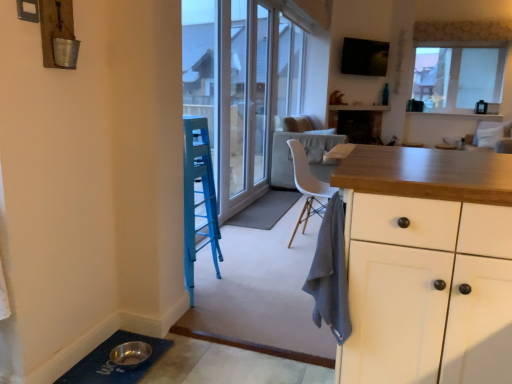
Identify the location of white plastic chair at center. Image resolution: width=512 pixels, height=384 pixels. (307, 186).

What is the approximate height of white fabric armchair at upper right?

It is 23.00 inches.

This screenshot has height=384, width=512. Describe the element at coordinates (331, 273) in the screenshot. I see `gray cotton towel at center` at that location.

Find the location of a particular element. The image size is (512, 384). gray fabric doormat at center, the 1th doormat from the right is located at coordinates (265, 210).

The image size is (512, 384). Identify the location of transparent glass window at upper right. (458, 77).

Find the location of `white plastic chair at center`. white plastic chair at center is located at coordinates pyautogui.click(x=307, y=186).

Who is smaller, white glossy screen door at center or transparent glass window at upper right?

white glossy screen door at center.

Between white glossy screen door at center and transparent glass window at upper right, which one is positioned behind?

transparent glass window at upper right.

From a real-world perspective, is white glossy screen door at center positioned above or below transparent glass window at upper right?

white glossy screen door at center is situated lower than transparent glass window at upper right in the real world.

Is gray fabric doormat at center, arranged as the second doormat when ordered from the bottom, far away from gray cotton towel at center?

Yes.

How far apart are gray fabric doormat at center, placed as the 1th doormat when sorted from back to front, and gray cotton towel at center?

gray fabric doormat at center, placed as the 1th doormat when sorted from back to front, is 7.95 feet from gray cotton towel at center.

Looking at this image, is gray fabric doormat at center, the 1th doormat from the right, wider or thinner than gray cotton towel at center?

Clearly, gray fabric doormat at center, the 1th doormat from the right, has more width compared to gray cotton towel at center.

You are a GUI agent. You are given a task and a screenshot of the screen. Output one action in this format:
    pyautogui.click(x=<x>, y=<y>)
    Task: Click on the doormat above the gray cotton towel at center (from the image's perspective)
    Image resolution: width=512 pixels, height=384 pixels.
    Given the screenshot: What is the action you would take?
    [x=265, y=210]

From a real-world perspective, which is physically below, transparent glass window at upper right or white glossy screen door at center?

white glossy screen door at center is physically lower.

Considering the positions of point (490, 89) and point (224, 53), is point (490, 89) closer or farther from the camera than point (224, 53)?

Clearly, point (490, 89) is more distant from the camera than point (224, 53).

Based on the photo, is transparent glass window at upper right not within white glossy screen door at center?

That's correct, transparent glass window at upper right is outside of white glossy screen door at center.

Between transparent glass window at upper right and white glossy screen door at center, which one has less height?

Standing shorter between the two is transparent glass window at upper right.

How far apart are gray fabric doormat at center, arranged as the second doormat when ordered from the bottom, and white plastic chair at center?

gray fabric doormat at center, arranged as the second doormat when ordered from the bottom, is 17.12 inches from white plastic chair at center.

Is gray fabric doormat at center, marked as the 1th doormat in a top-to-bottom arrangement, located outside white plastic chair at center?

Absolutely, gray fabric doormat at center, marked as the 1th doormat in a top-to-bottom arrangement, is external to white plastic chair at center.

Which is in front, point (233, 216) or point (324, 191)?

Positioned in front is point (324, 191).

Is blue rubber doormat at lower left, which is counted as the first doormat, starting from the left, completely or partially inside gray fabric doormat at center, arranged as the 2th doormat when viewed from the left?

No, gray fabric doormat at center, arranged as the 2th doormat when viewed from the left, does not contain blue rubber doormat at lower left, which is counted as the first doormat, starting from the left.

Locate an element on the screen. doormat below the gray fabric doormat at center, the 1th doormat from the right (from the image's perspective) is located at coordinates (114, 363).

Which of these two, gray fabric doormat at center, which is the 2th doormat from front to back, or blue rubber doormat at lower left, which is counted as the first doormat, starting from the left, is thinner?

gray fabric doormat at center, which is the 2th doormat from front to back, is thinner.

Considering the relative sizes of white glossy screen door at center and blue rubber doormat at lower left, which is the 2th doormat from back to front, in the image provided, is white glossy screen door at center bigger than blue rubber doormat at lower left, which is the 2th doormat from back to front,?

Correct, white glossy screen door at center is larger in size than blue rubber doormat at lower left, which is the 2th doormat from back to front.

From a real-world perspective, is white glossy screen door at center positioned over blue rubber doormat at lower left, marked as the 2th doormat in a top-to-bottom arrangement, based on gravity?

Indeed, from a real-world perspective, white glossy screen door at center stands above blue rubber doormat at lower left, marked as the 2th doormat in a top-to-bottom arrangement.

Can you tell me how much white glossy screen door at center and blue rubber doormat at lower left, marked as the 2th doormat in a top-to-bottom arrangement, differ in facing direction?

89.1 degrees separate the facing orientations of white glossy screen door at center and blue rubber doormat at lower left, marked as the 2th doormat in a top-to-bottom arrangement.

Is blue rubber doormat at lower left, which is counted as the first doormat, starting from the left, completely or partially inside white glossy screen door at center?

No, blue rubber doormat at lower left, which is counted as the first doormat, starting from the left, is not inside white glossy screen door at center.

The height and width of the screenshot is (384, 512). I want to click on cloth below the white fabric armchair at upper right (from the image's perspective), so click(331, 273).

From a real-world perspective, is white fabric armchair at upper right positioned above or below gray cotton towel at center?

white fabric armchair at upper right is situated higher than gray cotton towel at center in the real world.

Between white fabric armchair at upper right and gray cotton towel at center, which one has less height?

gray cotton towel at center.

Does white fabric armchair at upper right have a larger size compared to gray cotton towel at center?

Yes, white fabric armchair at upper right is bigger than gray cotton towel at center.

Locate an element on the screen. This screenshot has width=512, height=384. screen door on the left of the transparent glass window at upper right is located at coordinates (246, 101).

This screenshot has width=512, height=384. Find the location of `cloth below the gray fabric doormat at center, which is the 2th doormat from front to back (from the image's perspective)`. cloth below the gray fabric doormat at center, which is the 2th doormat from front to back (from the image's perspective) is located at coordinates (331, 273).

Considering their positions, is white fabric armchair at upper right positioned further to white glossy screen door at center than transparent glass window at upper right?

transparent glass window at upper right lies further to white glossy screen door at center than the other object.

Considering their positions, is blue rubber doormat at lower left, marked as the 2th doormat in a top-to-bottom arrangement, positioned closer to white plastic chair at center than gray fabric doormat at center, which is the 2th doormat from front to back?

gray fabric doormat at center, which is the 2th doormat from front to back, is closer to white plastic chair at center.

From the image, which object appears to be nearer to white fabric armchair at upper right, transparent glass window at upper right or gray fabric doormat at center, the 1th doormat from the right?

The object closer to white fabric armchair at upper right is transparent glass window at upper right.

Estimate the real-world distances between objects in this image. Which object is further from blue rubber doormat at lower left, which appears as the 1th doormat when viewed from the front, transparent glass window at upper right or gray fabric doormat at center, arranged as the second doormat when ordered from the bottom?

transparent glass window at upper right is positioned further to the anchor blue rubber doormat at lower left, which appears as the 1th doormat when viewed from the front.

Looking at this image, when comparing their distances from gray fabric doormat at center, arranged as the second doormat when ordered from the bottom, does white glossy screen door at center or blue rubber doormat at lower left, marked as the 2th doormat in a top-to-bottom arrangement, seem closer?

Among the two, white glossy screen door at center is located nearer to gray fabric doormat at center, arranged as the second doormat when ordered from the bottom.

Based on their spatial positions, is blue rubber doormat at lower left, which appears as the 1th doormat when viewed from the front, or gray cotton towel at center closer to gray fabric doormat at center, arranged as the second doormat when ordered from the bottom?

blue rubber doormat at lower left, which appears as the 1th doormat when viewed from the front, is closer to gray fabric doormat at center, arranged as the second doormat when ordered from the bottom.

Estimate the real-world distances between objects in this image. Which object is closer to blue rubber doormat at lower left, which is the 2th doormat from back to front, gray cotton towel at center or transparent glass window at upper right?

gray cotton towel at center is positioned closer to the anchor blue rubber doormat at lower left, which is the 2th doormat from back to front.

Based on their spatial positions, is white fabric armchair at upper right or blue rubber doormat at lower left, which appears as the 1th doormat when viewed from the front, further from white glossy screen door at center?

white fabric armchair at upper right is positioned further to the anchor white glossy screen door at center.

This screenshot has height=384, width=512. What are the coordinates of `chair between gray cotton towel at center and white fabric armchair at upper right from front to back` in the screenshot? It's located at (307, 186).

The image size is (512, 384). Identify the location of screen door located between blue rubber doormat at lower left, which appears as the 1th doormat when viewed from the front, and white fabric armchair at upper right in the depth direction. (246, 101).

Locate an element on the screen. The image size is (512, 384). doormat between white glossy screen door at center and white fabric armchair at upper right is located at coordinates click(x=265, y=210).

You are a GUI agent. You are given a task and a screenshot of the screen. Output one action in this format:
    pyautogui.click(x=<x>, y=<y>)
    Task: Click on the chair between gray fabric doormat at center, arranged as the 2th doormat when viewed from the left, and white fabric armchair at upper right
    
    Given the screenshot: What is the action you would take?
    pyautogui.click(x=307, y=186)